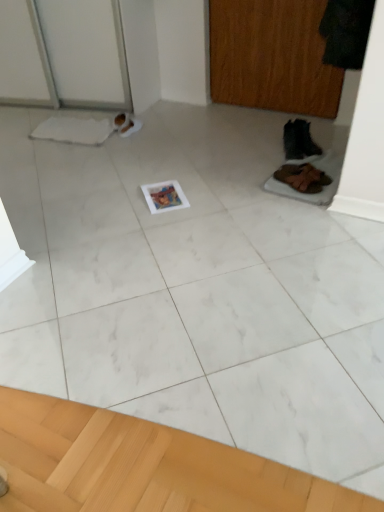
Question: Is brown suede shoes at lower right, the second footwear viewed from the back, inside the boundaries of black leather boot at right, the second footwear when ordered from bottom to top, or outside?

Choices:
 (A) outside
 (B) inside

Answer: (A)

Question: Based on their sizes in the image, would you say brown suede shoes at lower right, which appears as the second footwear when viewed from the top, is bigger or smaller than black leather boot at right, marked as the 2th footwear in a front-to-back arrangement?

Choices:
 (A) small
 (B) big

Answer: (A)

Question: Considering the real-world distances, which object is farthest from the brown suede shoes at lower right, the second footwear viewed from the back?

Choices:
 (A) wooden screen door at upper right
 (B) black leather boot at right, the second footwear when ordered from bottom to top

Answer: (A)

Question: Estimate the real-world distances between objects in this image. Which object is closer to the wooden screen door at upper right?

Choices:
 (A) black leather boot at right, the second footwear when ordered from bottom to top
 (B) brown suede shoes at lower right, the first footwear viewed from the front

Answer: (A)